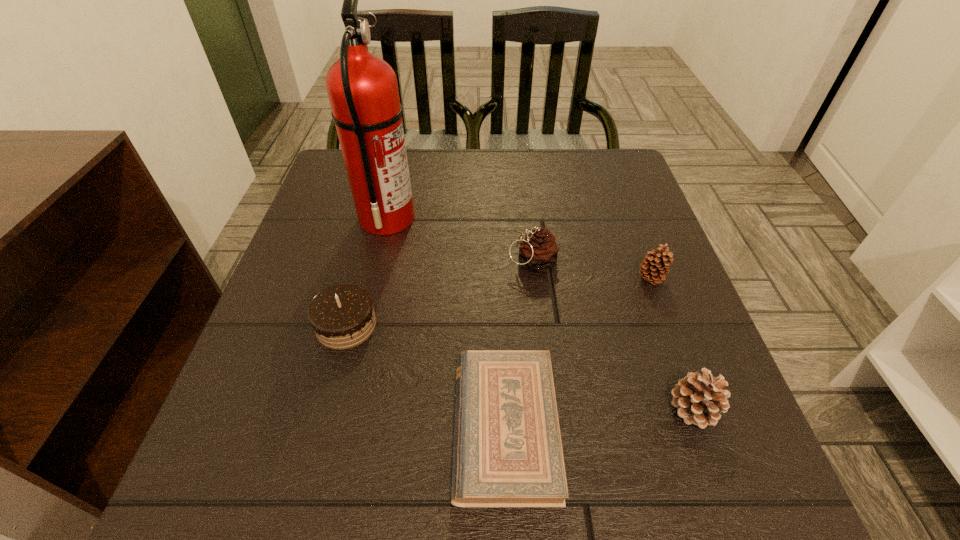
Find the location of a particular element. The width and height of the screenshot is (960, 540). free space between the chocolate cake and the leftmost pinecone is located at coordinates (440, 294).

I want to click on object that ranks as the fifth closest to the leftmost pinecone, so click(699, 398).

Choose which object is the third nearest neighbor to the Bible. Please provide its 2D coordinates. Your answer should be formatted as a tuple, i.e. [(x, y)], where the tuple contains the x and y coordinates of a point satisfying the conditions above.

[(539, 251)]

The image size is (960, 540). In order to click on pinecone that is the second nearest to the chocolate cake in this screenshot , I will do `click(699, 398)`.

Identify which pinecone is the second nearest to the leftmost pinecone. Please provide its 2D coordinates. Your answer should be formatted as a tuple, i.e. [(x, y)], where the tuple contains the x and y coordinates of a point satisfying the conditions above.

[(699, 398)]

Identify the location of vacant region that satisfies the following two spatial constraints: 1. at the nozzle of the nearest pinecone; 2. on the right side of the tallest object. Image resolution: width=960 pixels, height=540 pixels. (343, 409).

Locate an element on the screen. This screenshot has width=960, height=540. free space in the image that satisfies the following two spatial constraints: 1. on the back side of the nearest pinecone; 2. at the nozzle of the tallest object is located at coordinates (625, 218).

This screenshot has height=540, width=960. I want to click on vacant space that satisfies the following two spatial constraints: 1. with a leaf charm attached to the nearest pinecone; 2. on the right side of the leftmost pinecone, so click(x=549, y=409).

The height and width of the screenshot is (540, 960). I want to click on blank area in the image that satisfies the following two spatial constraints: 1. on the back side of the nearest pinecone; 2. with a leaf charm attached to the leftmost pinecone, so click(640, 262).

This screenshot has height=540, width=960. In order to click on free location that satisfies the following two spatial constraints: 1. at the nozzle of the tallest object; 2. on the back side of the nearest pinecone in this screenshot , I will do `click(343, 409)`.